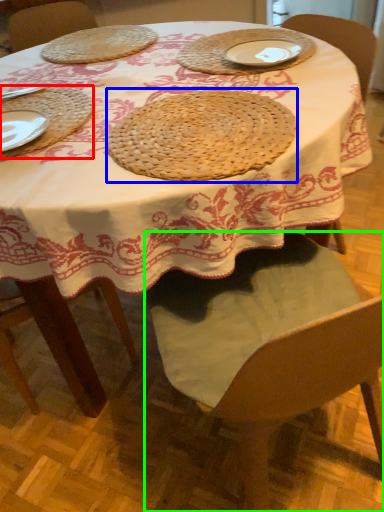
Question: Considering the real-world distances, which object is farthest from tray (highlighted by a red box)? pie (highlighted by a blue box) or chair (highlighted by a green box)?

Choices:
 (A) pie
 (B) chair

Answer: (B)